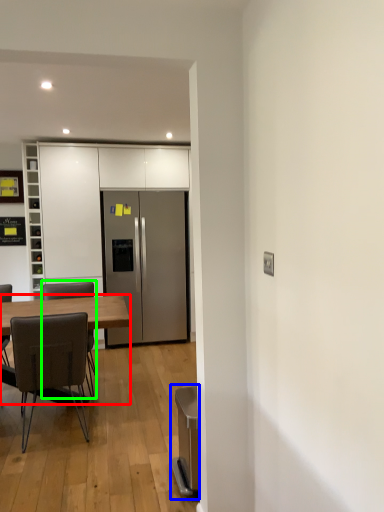
Question: Which object is positioned closest to desk (highlighted by a red box)? Select from appliance (highlighted by a blue box) and chair (highlighted by a green box).

Choices:
 (A) appliance
 (B) chair

Answer: (A)